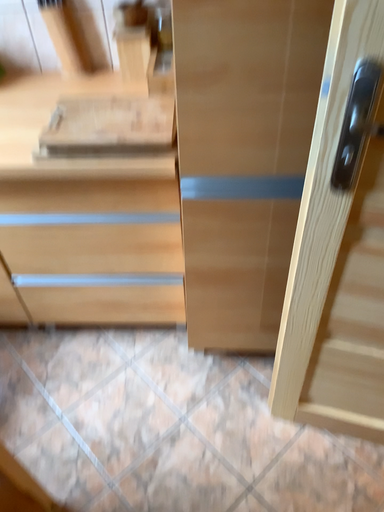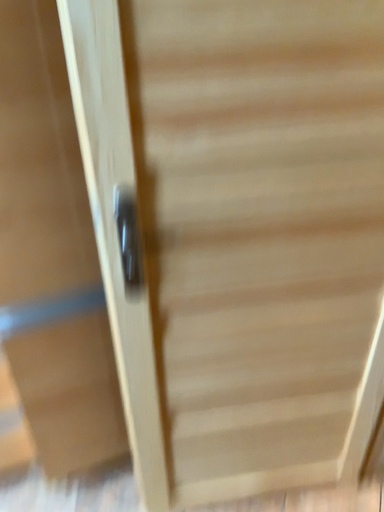
Question: Which way did the camera rotate in the video?

Choices:
 (A) rotated left
 (B) rotated right

Answer: (B)